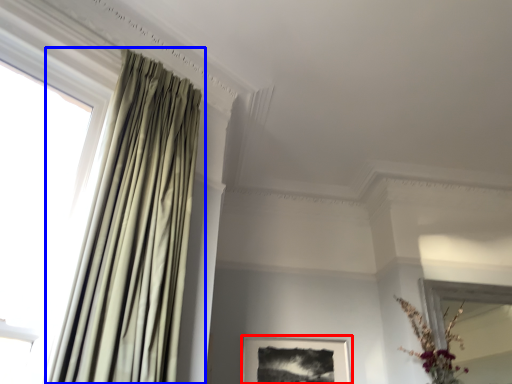
Question: Which object is further to the camera taking this photo, picture frame (highlighted by a red box) or curtain (highlighted by a blue box)?

Choices:
 (A) picture frame
 (B) curtain

Answer: (A)